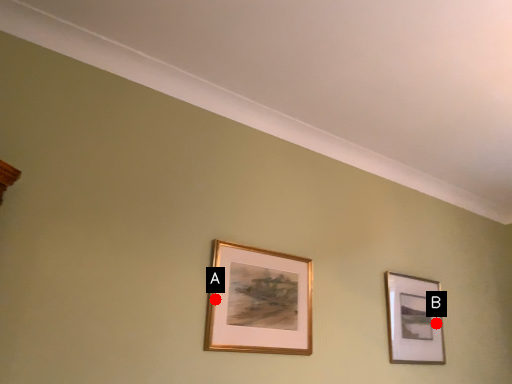
Question: Two points are circled on the image, labeled by A and B beside each circle. Which point is closer to the camera?

Choices:
 (A) A is closer
 (B) B is closer

Answer: (A)